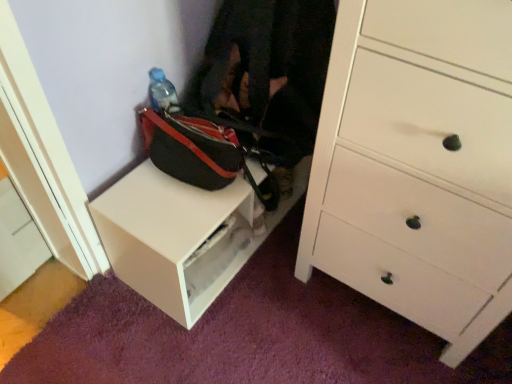
Question: Based on their sizes in the image, would you say white matte table at lower left is bigger or smaller than black fabric bag at center?

Choices:
 (A) small
 (B) big

Answer: (B)

Question: From the image's perspective, is white matte table at lower left above or below black fabric bag at center?

Choices:
 (A) below
 (B) above

Answer: (A)

Question: Which is nearer to the black fabric bag at center?

Choices:
 (A) white matte table at lower left
 (B) white wood chest of drawers at center right

Answer: (A)

Question: Which is farther from the black fabric bag at center?

Choices:
 (A) white wood chest of drawers at center right
 (B) white matte table at lower left

Answer: (A)